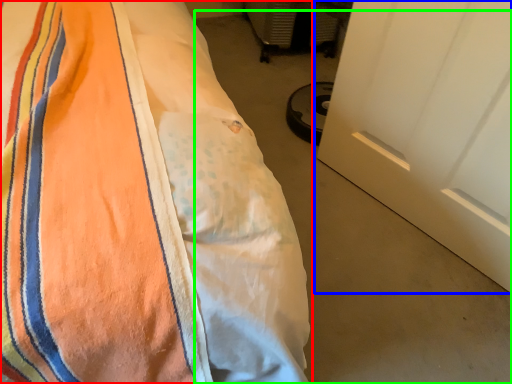
Question: Which is nearer to the bed (highlighted by a red box)? door (highlighted by a blue box) or concrete (highlighted by a green box).

Choices:
 (A) door
 (B) concrete

Answer: (A)